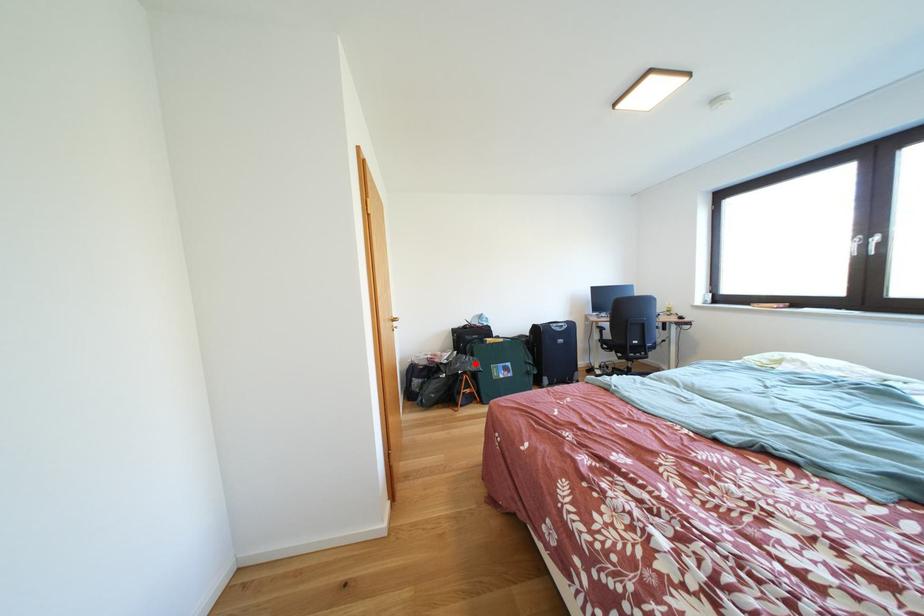
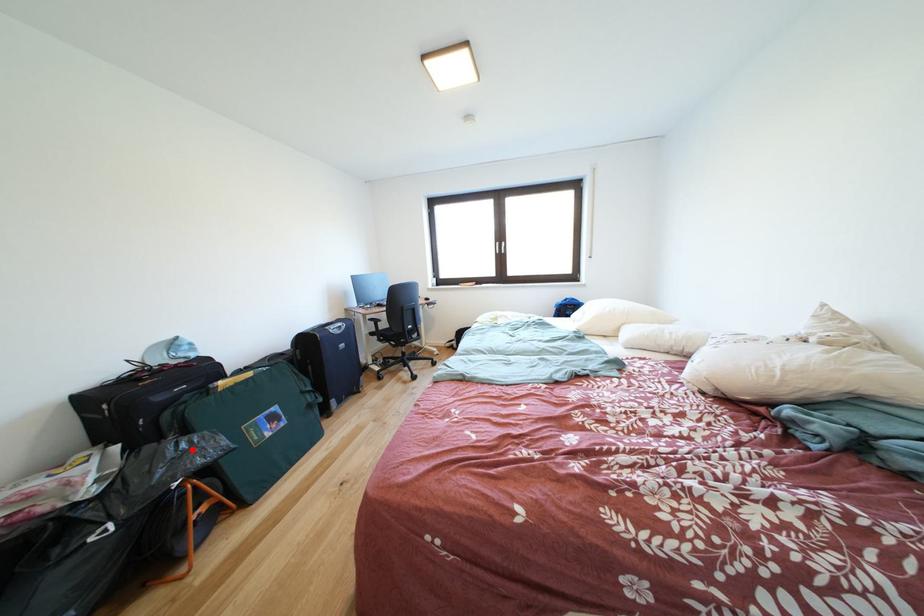
I am providing you with two images of the same scene from different viewpoints. A red point is marked on the first image and another point is marked on the second image. Is the marked point in image1 the same physical position as the marked point in image2?

Yes